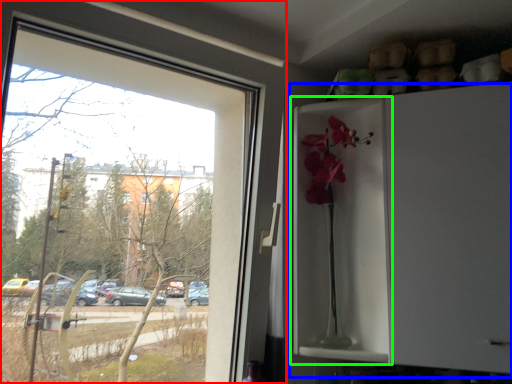
Question: Which object is the farthest from window (highlighted by a red box)? Choose among these: fridge (highlighted by a blue box) or screen door (highlighted by a green box).

Choices:
 (A) fridge
 (B) screen door

Answer: (A)